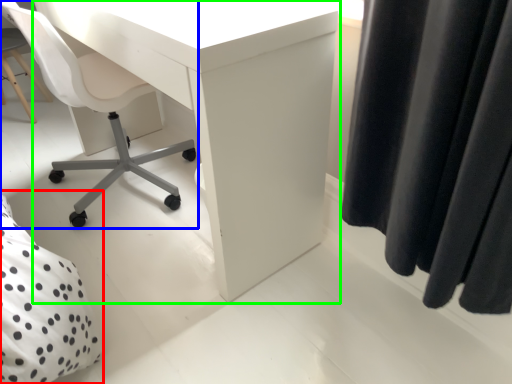
Question: Based on their relative distances, which object is nearer to bed (highlighted by a red box)? Choose from chair (highlighted by a blue box) and desk (highlighted by a green box).

Choices:
 (A) chair
 (B) desk

Answer: (B)